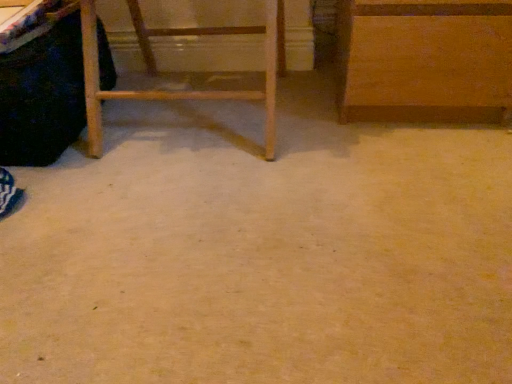
Where is `vacant region to the right of wooden ladder at left, the first furniture positioned from the left`? The height and width of the screenshot is (384, 512). vacant region to the right of wooden ladder at left, the first furniture positioned from the left is located at coordinates (340, 128).